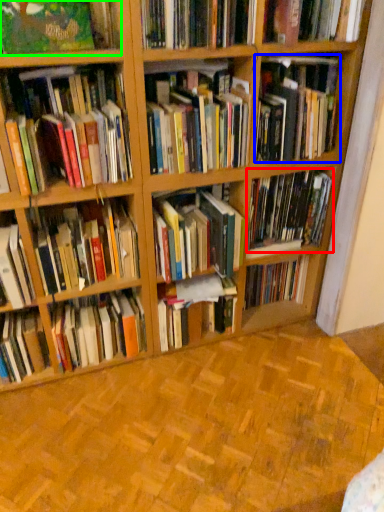
Question: Based on their relative distances, which object is nearer to book (highlighted by a red box)? Choose from book (highlighted by a blue box) and book (highlighted by a green box).

Choices:
 (A) book
 (B) book

Answer: (A)